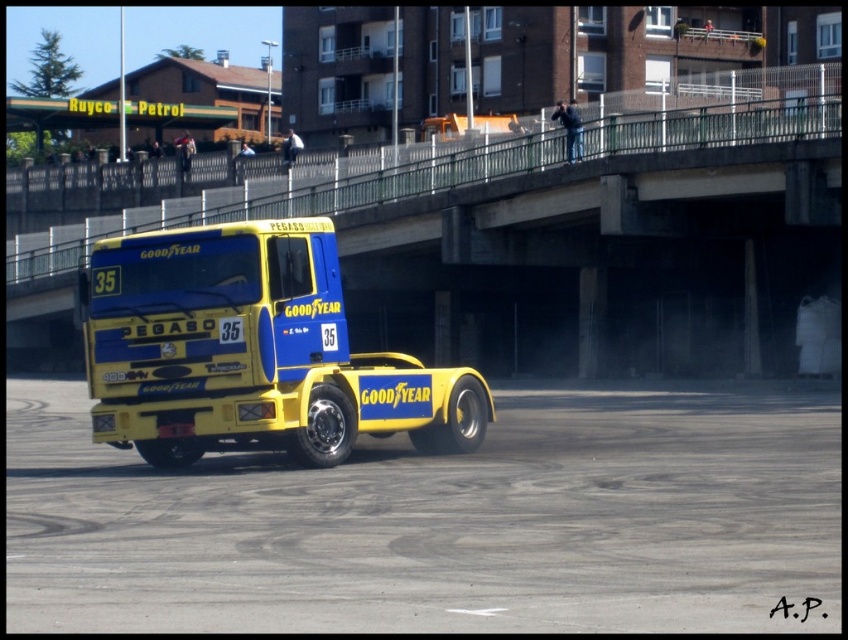
Question: Is yellow rubber dirt track at center positioned in front of yellow matte truck at center?

Choices:
 (A) no
 (B) yes

Answer: (B)

Question: Does yellow rubber dirt track at center have a lesser width compared to yellow matte truck at center?

Choices:
 (A) no
 (B) yes

Answer: (A)

Question: Is yellow rubber dirt track at center above yellow matte truck at center?

Choices:
 (A) yes
 (B) no

Answer: (B)

Question: Which of the following is the farthest from the observer?

Choices:
 (A) yellow rubber dirt track at center
 (B) yellow matte truck at center

Answer: (B)

Question: Among these points, which one is nearest to the camera?

Choices:
 (A) (433, 572)
 (B) (216, 429)

Answer: (A)